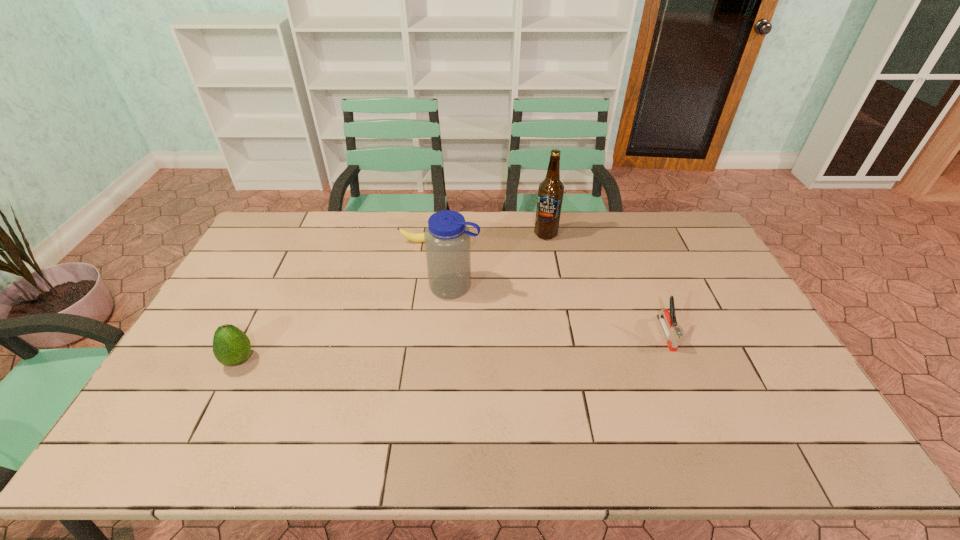
The image size is (960, 540). What are the coordinates of `object identified as the third closest to the banana` in the screenshot? It's located at (231, 346).